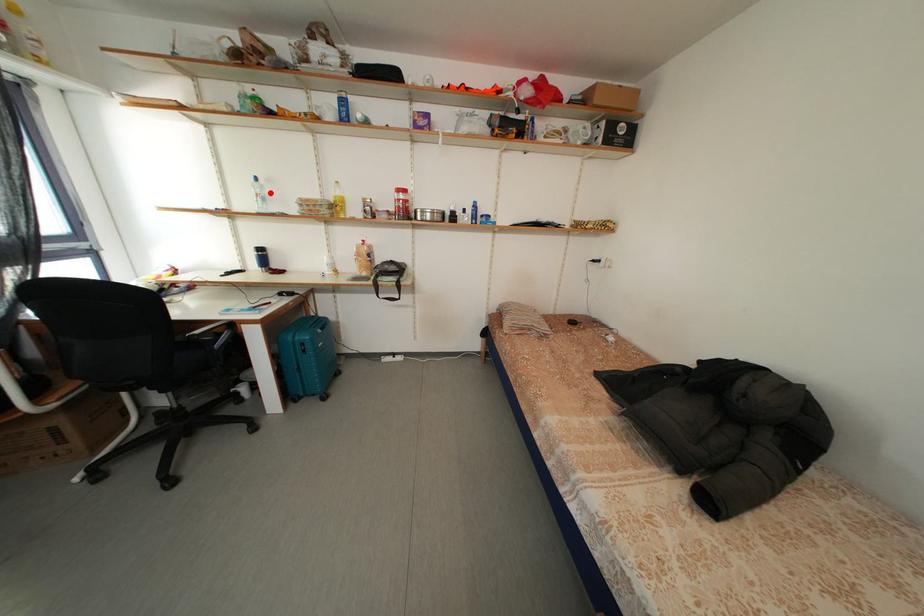
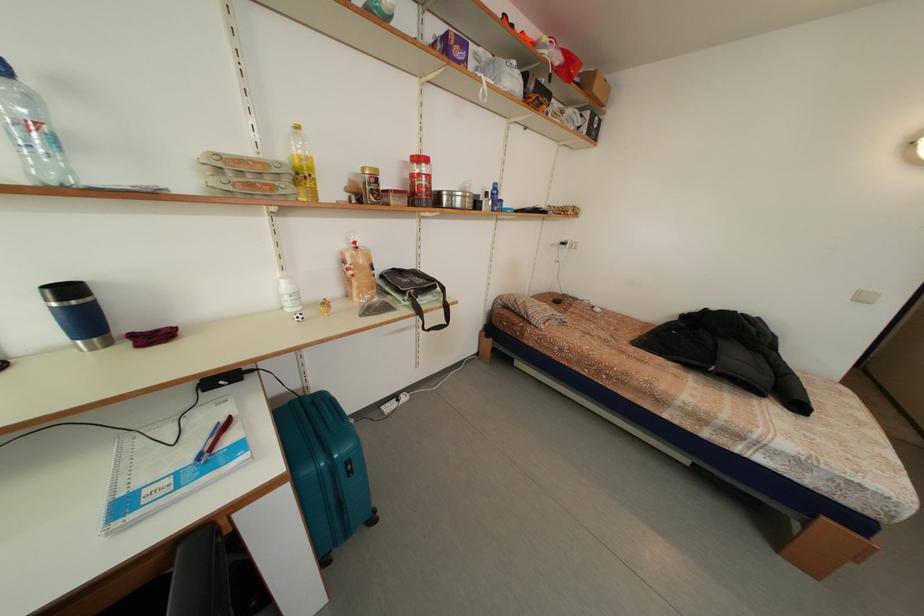
Question: I am providing you with two images of the same scene from different viewpoints. Image1 has a red point marked. In image2, the corresponding 3D location appears at what relative position? Reply with the corresponding letter.

Choices:
 (A) Closer
 (B) Farther

Answer: (B)